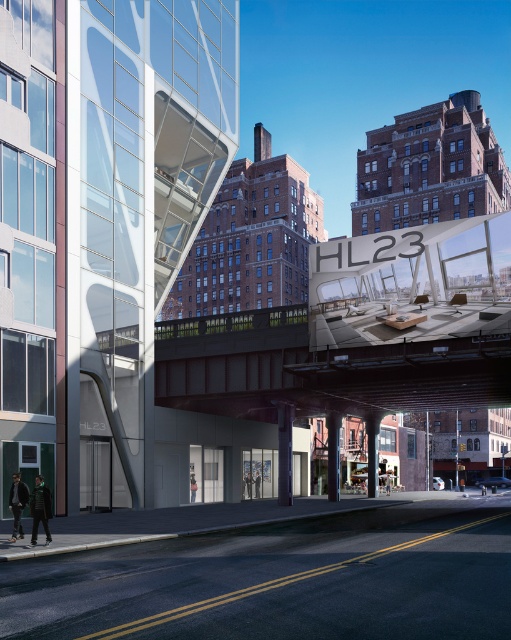
You are standing at the center of the street in the image. You see a dark green jacket at lower left. Where is the dark green jacket located relative to your position?

The dark green jacket at lower left is located at point (39, 509) relative to your position.

You are standing at the point with coordinates (39, 509) in the image. What object are you standing on?

You are standing on the dark green jacket at lower left.